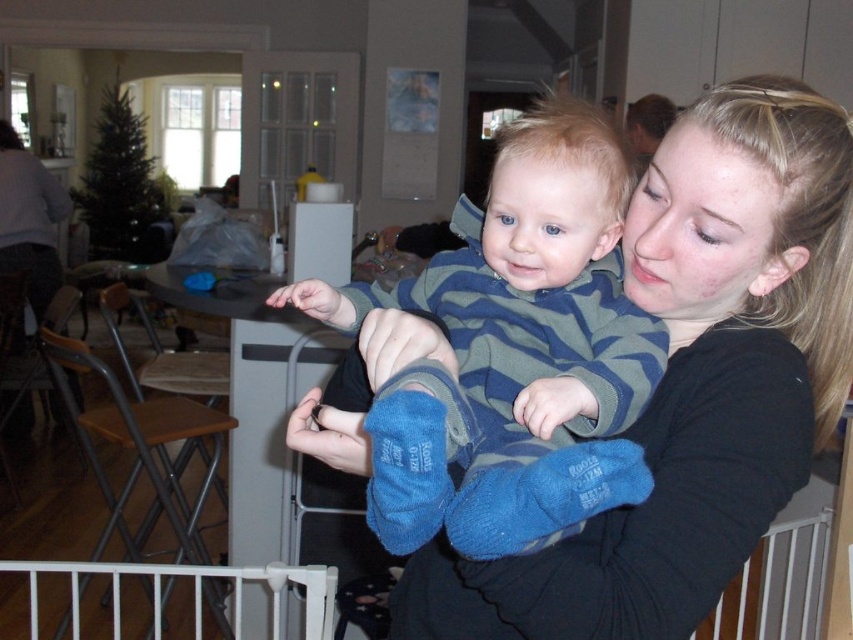
Question: Which point is farther to the camera?

Choices:
 (A) (596, 172)
 (B) (770, 600)

Answer: (B)

Question: Does white plastic rail at lower right have a lesser width compared to white plastic gate at lower left?

Choices:
 (A) no
 (B) yes

Answer: (B)

Question: Which object appears farthest from the camera in this image?

Choices:
 (A) white plastic rail at lower right
 (B) blue fleece socks at center

Answer: (A)

Question: Is blue fleece socks at center thinner than white plastic rail at lower right?

Choices:
 (A) yes
 (B) no

Answer: (A)

Question: Does blue fleece socks at center have a lesser width compared to white plastic gate at lower left?

Choices:
 (A) no
 (B) yes

Answer: (B)

Question: Among these points, which one is nearest to the camera?

Choices:
 (A) (32, 582)
 (B) (538, 342)

Answer: (B)